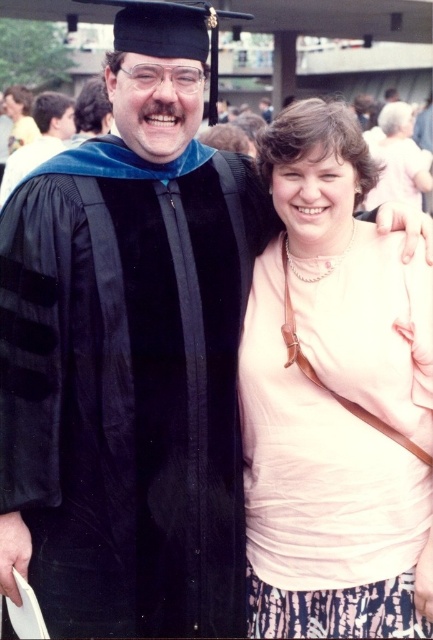
From the picture: Does pink fabric shirt at center have a lesser height compared to matte black graduation gown at upper left?

In fact, pink fabric shirt at center may be taller than matte black graduation gown at upper left.

Can you confirm if pink fabric shirt at center is positioned to the right of matte black graduation gown at upper left?

Indeed, pink fabric shirt at center is positioned on the right side of matte black graduation gown at upper left.

This screenshot has width=433, height=640. Identify the location of pink fabric shirt at center. (x=333, y=401).